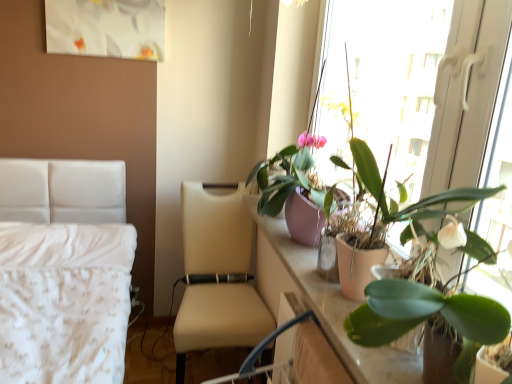
Question: Can you confirm if pink matte plant pot at right is positioned to the right of green matte plant at upper right, placed as the first houseplant when sorted from bottom to top?

Choices:
 (A) yes
 (B) no

Answer: (B)

Question: From a real-world perspective, does pink matte plant pot at right sit lower than green matte plant at upper right, which is the third houseplant from top to bottom?

Choices:
 (A) no
 (B) yes

Answer: (A)

Question: Is pink matte plant pot at right not inside green matte plant at upper right, which is the third houseplant from top to bottom?

Choices:
 (A) yes
 (B) no

Answer: (A)

Question: Does pink matte plant pot at right turn towards green matte plant at upper right, placed as the first houseplant when sorted from bottom to top?

Choices:
 (A) yes
 (B) no

Answer: (B)

Question: Are pink matte plant pot at right and green matte plant at upper right, placed as the first houseplant when sorted from bottom to top, far apart?

Choices:
 (A) yes
 (B) no

Answer: (B)

Question: From a real-world perspective, is pink matte pot at upper right, which appears as the 2th houseplant when viewed from the top, positioned above or below beige leather chair at center?

Choices:
 (A) below
 (B) above

Answer: (B)

Question: Is pink matte pot at upper right, which appears as the 2th houseplant when viewed from the top, wider or thinner than beige leather chair at center?

Choices:
 (A) wide
 (B) thin

Answer: (B)

Question: Based on their positions, is pink matte pot at upper right, which is the second houseplant in bottom-to-top order, located to the left or right of beige leather chair at center?

Choices:
 (A) left
 (B) right

Answer: (B)

Question: Considering their positions, is pink matte pot at upper right, which is the second houseplant in bottom-to-top order, located in front of or behind beige leather chair at center?

Choices:
 (A) behind
 (B) front

Answer: (B)

Question: Does point (421, 39) appear closer or farther from the camera than point (304, 168)?

Choices:
 (A) farther
 (B) closer

Answer: (A)

Question: Considering their positions, is pink matte plant pot at right located in front of or behind pink matte pot at upper right, which appears as the 2th houseplant when viewed from the top?

Choices:
 (A) front
 (B) behind

Answer: (A)

Question: Is pink matte plant pot at right taller or shorter than pink matte pot at upper right, which is the second houseplant in bottom-to-top order?

Choices:
 (A) short
 (B) tall

Answer: (B)

Question: Would you say pink matte plant pot at right is inside or outside pink matte pot at upper right, which appears as the 2th houseplant when viewed from the top?

Choices:
 (A) inside
 (B) outside

Answer: (B)

Question: Do you think pink matte pot at upper right, which is the second houseplant in bottom-to-top order, is within green matte plant at upper right, which is the third houseplant from top to bottom, or outside of it?

Choices:
 (A) outside
 (B) inside

Answer: (A)

Question: Considering the positions of pink matte pot at upper right, which appears as the 2th houseplant when viewed from the top, and green matte plant at upper right, which is the third houseplant from top to bottom, in the image, is pink matte pot at upper right, which appears as the 2th houseplant when viewed from the top, wider or thinner than green matte plant at upper right, which is the third houseplant from top to bottom,?

Choices:
 (A) wide
 (B) thin

Answer: (A)